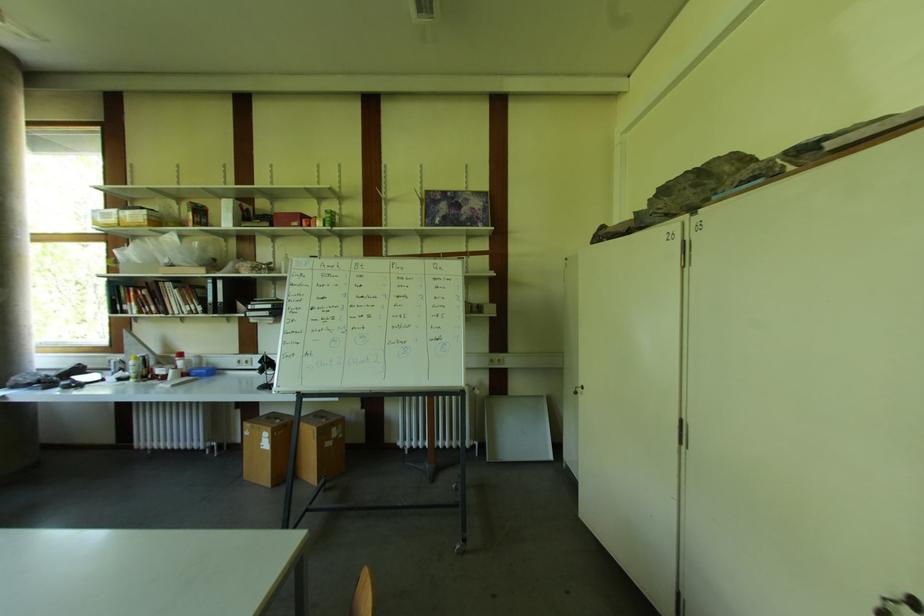
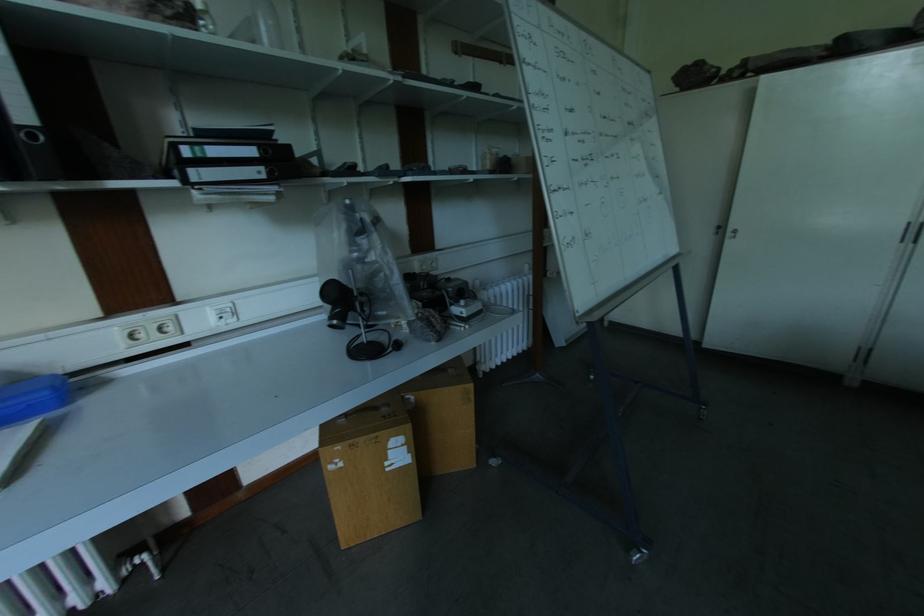
In the second image, find the point that corresponds to [208,373] in the first image.

(46, 395)